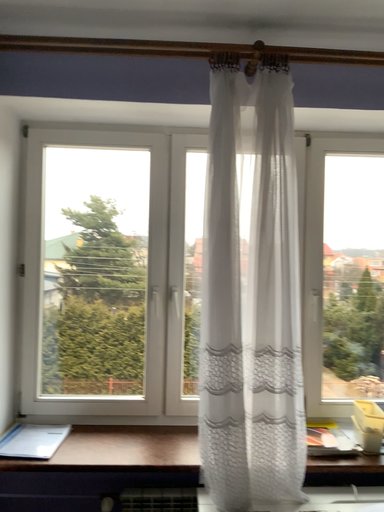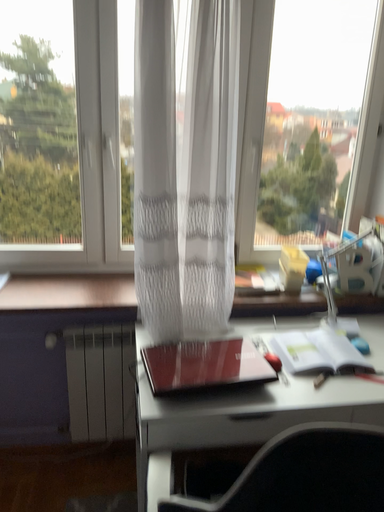
Question: Which way did the camera rotate in the video?

Choices:
 (A) rotated downward
 (B) rotated upward

Answer: (A)